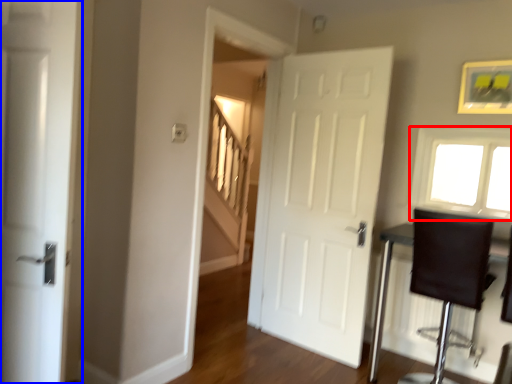
Question: Which object appears farthest to the camera in this image, window (highlighted by a red box) or door (highlighted by a blue box)?

Choices:
 (A) window
 (B) door

Answer: (A)